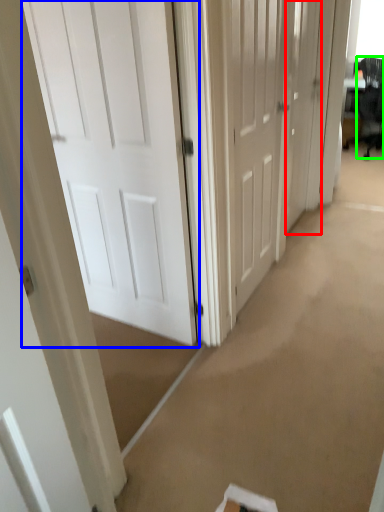
Question: Based on their relative distances, which object is farther from door (highlighted by a red box)? Choose from door (highlighted by a blue box) and swivel chair (highlighted by a green box).

Choices:
 (A) door
 (B) swivel chair

Answer: (B)